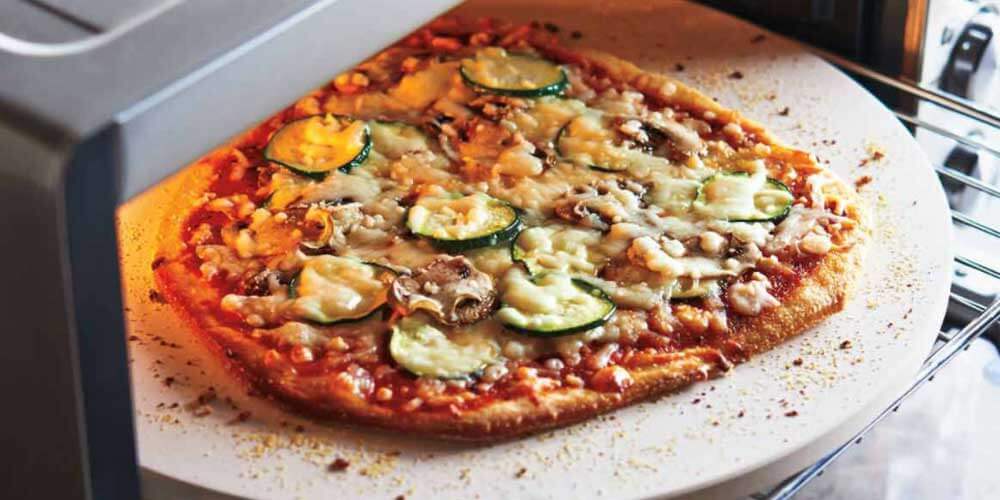
This screenshot has width=1000, height=500. In order to click on inside of oven in this screenshot , I will do `click(832, 32)`.